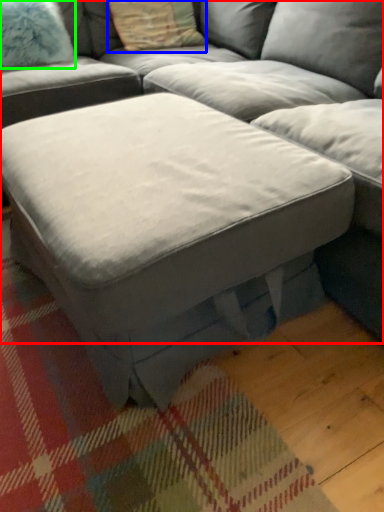
Question: Which object is the closest to the studio couch (highlighted by a red box)? Choose among these: pillow (highlighted by a blue box) or pillow (highlighted by a green box).

Choices:
 (A) pillow
 (B) pillow

Answer: (A)